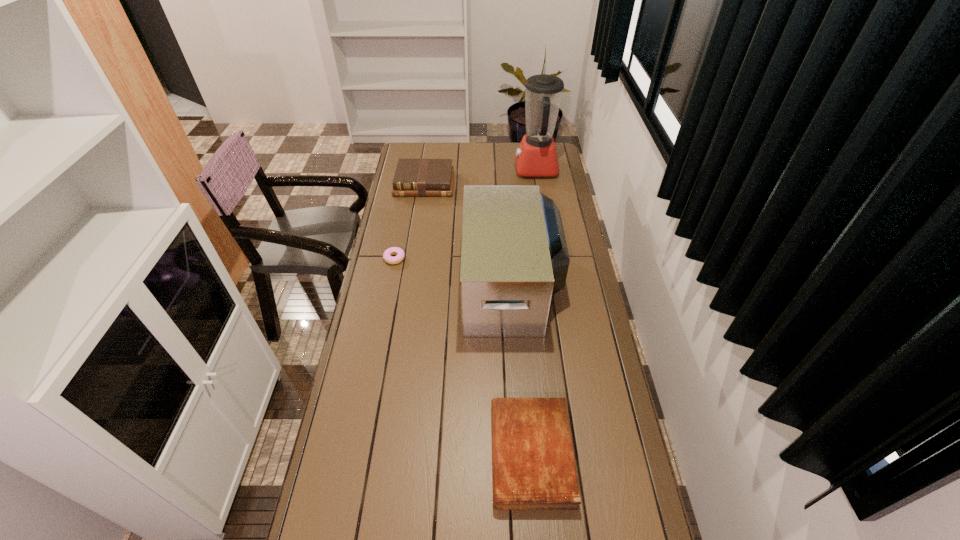
This screenshot has height=540, width=960. Identify the location of doughnut that is at the left edge. (387, 256).

Locate an element on the screen. This screenshot has height=540, width=960. blender that is at the right edge is located at coordinates (536, 156).

At what (x,y) coordinates should I click in order to perform the action: click on microwave oven at the right edge. Please return your answer as a coordinate pair (x, y). Looking at the image, I should click on (x=514, y=257).

You are a GUI agent. You are given a task and a screenshot of the screen. Output one action in this format:
    pyautogui.click(x=<x>, y=<y>)
    Task: Click on the object that is at the far right corner
    This screenshot has height=540, width=960.
    Given the screenshot: What is the action you would take?
    pyautogui.click(x=536, y=156)

The width and height of the screenshot is (960, 540). In the image, there is a desktop. Find the location of `vacant area at the left edge`. vacant area at the left edge is located at coordinates (368, 401).

This screenshot has width=960, height=540. In the image, there is a desktop. What are the coordinates of `free space at the right edge` in the screenshot? It's located at (573, 233).

The width and height of the screenshot is (960, 540). In the image, there is a desktop. In order to click on vacant space at the far left corner in this screenshot , I will do `click(426, 157)`.

Identify the location of vacant space in between the microwave oven and the second shortest object. The width and height of the screenshot is (960, 540). (521, 369).

The image size is (960, 540). I want to click on free point between the nearer Bible and the second tallest object, so click(521, 369).

Locate an element on the screen. vacant space that's between the shorter Bible and the doughnut is located at coordinates (463, 356).